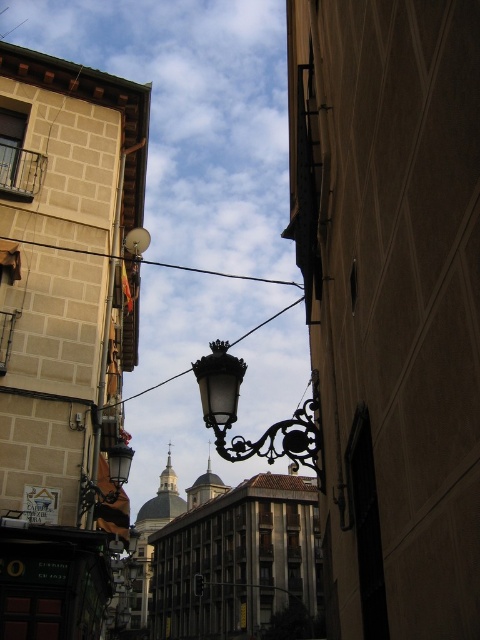
You are standing at the point marked by the coordinates (267, 428). Looking around, you see a polished brass lantern at center. Which direction should you face to see the building with the balcony and satellite dish?

The polished brass lantern at center is located at point (267, 428). To see the building with the balcony and satellite dish, you should face towards the left side of the image since the building on the left has a balcony with metal railings and a small satellite dish attached to its exterior wall.

You are a city planner assessing the street layout. You need to determine if the polished brass lantern at center will block the view of the black wire at upper center from a pedestrian standing on the sidewalk. Based on the height comparison provided, what is your conclusion?

The polished brass lantern at center is shorter than the black wire at upper center, so the lantern will not block the view of the black wire at upper center from a pedestrian standing on the sidewalk.